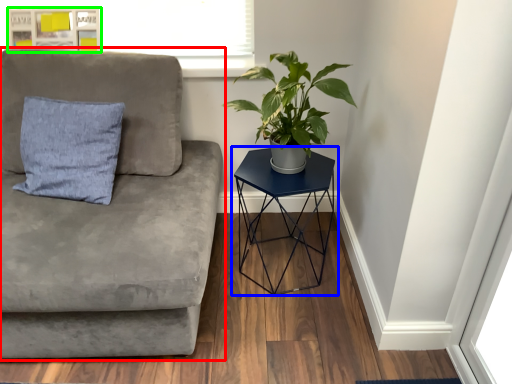
Question: Considering the real-world distances, which object is closest to studio couch (highlighted by a red box)? table (highlighted by a blue box) or bulletin board (highlighted by a green box).

Choices:
 (A) table
 (B) bulletin board

Answer: (A)